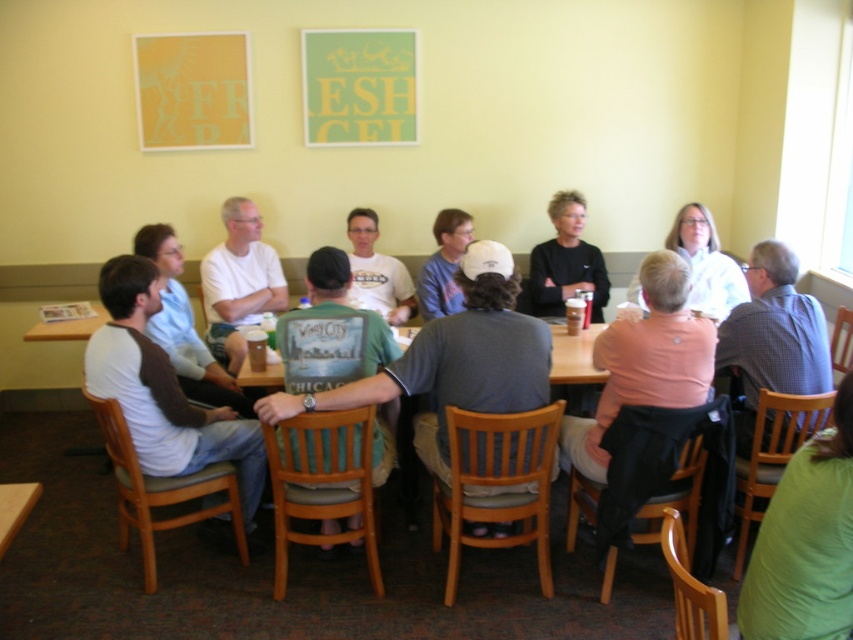
Question: Which object appears closest to the camera in this image?

Choices:
 (A) matte gray shirt at center
 (B) green fabric shirt at lower right
 (C) black matte shirt at center

Answer: (B)

Question: Can you confirm if green fabric shirt at lower right is positioned to the left of gray cotton shirt at center?

Choices:
 (A) yes
 (B) no

Answer: (B)

Question: Does white cotton shirt at left have a smaller size compared to white t-shirt at center?

Choices:
 (A) no
 (B) yes

Answer: (A)

Question: Is black matte shirt at center to the right of matte gray shirt at center from the viewer's perspective?

Choices:
 (A) no
 (B) yes

Answer: (B)

Question: Which point is farther to the camera?

Choices:
 (A) (828, 572)
 (B) (177, 381)
 (C) (393, 298)
 (D) (714, 252)

Answer: (C)

Question: Among these objects, which one is farthest from the camera?

Choices:
 (A) matte gray shirt at center
 (B) black matte shirt at center
 (C) white cotton shirt at left
 (D) white matte shirt at upper center

Answer: (B)